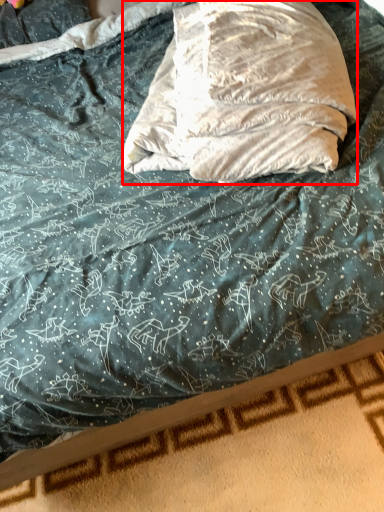
Question: Considering the relative positions of throw pillow (annotated by the red box) and bed frame in the image provided, where is throw pillow (annotated by the red box) located with respect to the staircase?

Choices:
 (A) right
 (B) left

Answer: (A)